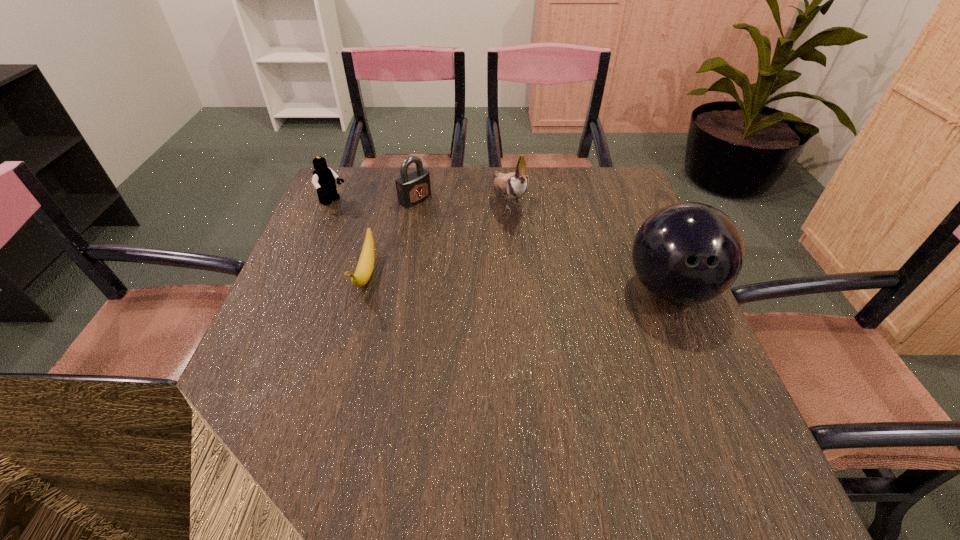
Identify the location of the second object from left to right. click(365, 265).

Locate an element on the screen. This screenshot has height=540, width=960. banana is located at coordinates (365, 265).

You are a GUI agent. You are given a task and a screenshot of the screen. Output one action in this format:
    pyautogui.click(x=<x>, y=<y>)
    Task: Click on the rightmost object
    The image size is (960, 540).
    Given the screenshot: What is the action you would take?
    pyautogui.click(x=687, y=253)

Image resolution: width=960 pixels, height=540 pixels. In order to click on Lego in this screenshot , I will do [324, 178].

Identify the location of bird. (513, 185).

I want to click on the third object from left to right, so click(x=412, y=188).

Where is `free space located 0.240m at the stem of the banana`? The height and width of the screenshot is (540, 960). free space located 0.240m at the stem of the banana is located at coordinates (331, 403).

Locate an element on the screen. The image size is (960, 540). blank space located 0.130m on the side of the bowling ball with the finger holes is located at coordinates (709, 378).

The width and height of the screenshot is (960, 540). Identify the location of free space located on the front-facing side of the Lego. (447, 261).

Where is `vacant space located 0.170m on the front-facing side of the Lego`? Image resolution: width=960 pixels, height=540 pixels. vacant space located 0.170m on the front-facing side of the Lego is located at coordinates (384, 229).